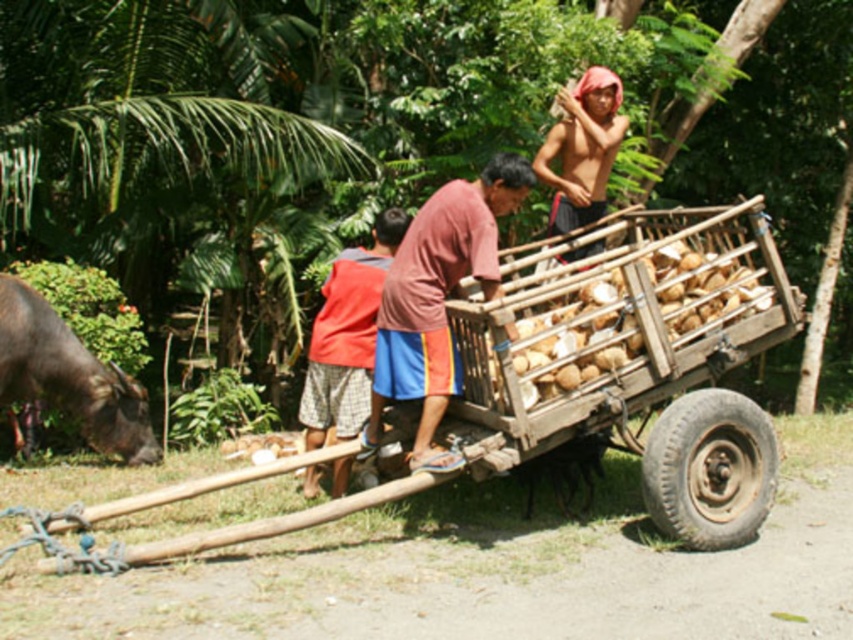
Question: From the image, what is the correct spatial relationship of brown fabric shirt at center in relation to shiny red cloth at upper right?

Choices:
 (A) right
 (B) left

Answer: (B)

Question: Which of the following is the closest to the observer?

Choices:
 (A) brown rough skin bull at lower left
 (B) wooden cart at center
 (C) brown wooden coconuts at center
 (D) brown fabric shirt at center

Answer: (B)

Question: Which of these objects is positioned farthest from the brown fabric shirt at center?

Choices:
 (A) brown rough skin bull at lower left
 (B) red fabric shirt at center
 (C) wooden cart at center

Answer: (A)

Question: Among these points, which one is farthest from the camera?

Choices:
 (A) (68, 358)
 (B) (524, 289)
 (C) (428, 412)

Answer: (A)

Question: From the image, what is the correct spatial relationship of brown wooden coconuts at center in relation to brown rough skin bull at lower left?

Choices:
 (A) right
 (B) left

Answer: (A)

Question: Can you confirm if red fabric shirt at center is bigger than shiny red cloth at upper right?

Choices:
 (A) no
 (B) yes

Answer: (A)